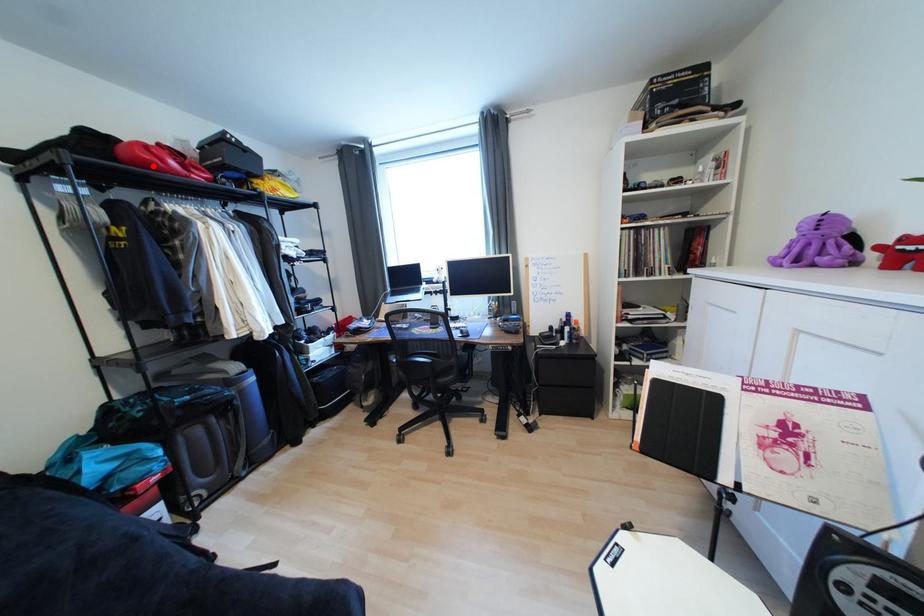
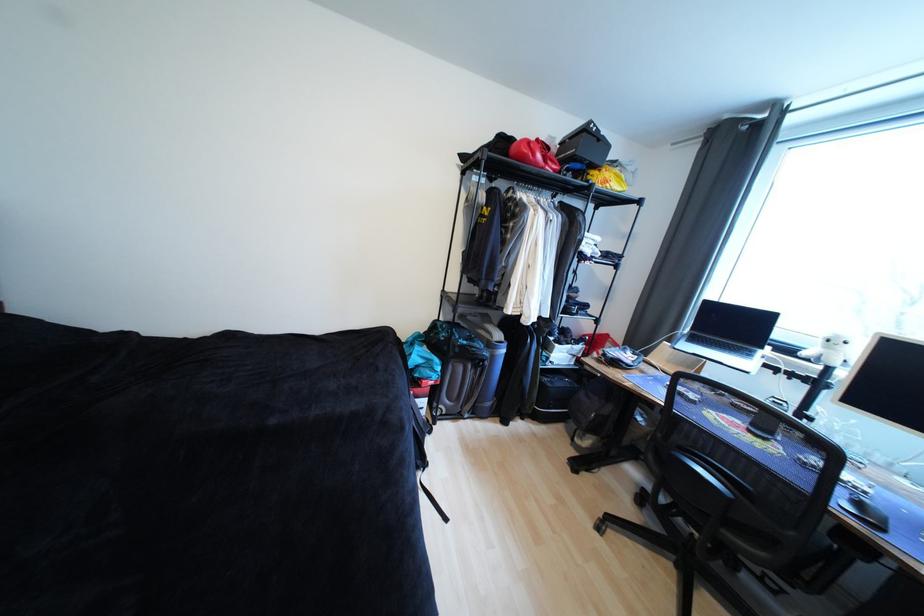
In the second image, find the point that corresponds to the highlighted location in the first image.

(529, 159)